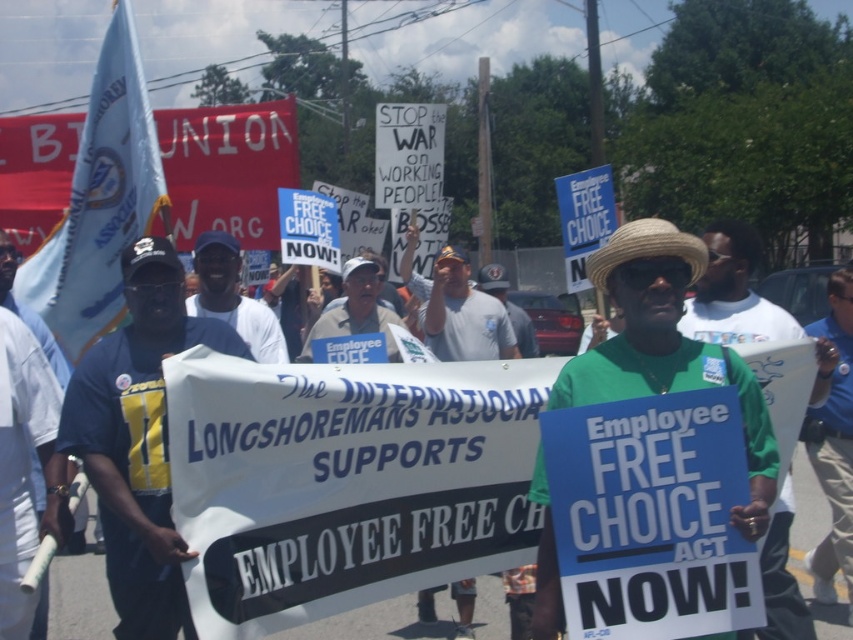
You are a photographer trying to capture the protest scene. You notice two points in the image at coordinates point (402, 259) and point (352, 285). Which point is closer to your camera lens?

Point (402, 259) is further to the viewer than point (352, 285), so the point closer to the camera lens is point (352, 285).

You are a photographer standing at the front of the protest march. You want to take a photo that includes both the white baseball cap at center and the blue fabric sign at center. Which object will appear larger in your photo?

The white baseball cap at center will appear larger in the photo because it is closer to the viewer than the blue fabric sign at center.

You are a photographer trying to capture the protest scene. You want to ensure both the white baseball cap at center and the blue fabric sign at center are clearly visible in your shot. Given their sizes, which object should you focus on first to ensure it doesn

The white baseball cap at center is thinner than the blue fabric sign at center, so you should focus on the blue fabric sign at center first as it is larger and more prominent in the scene.